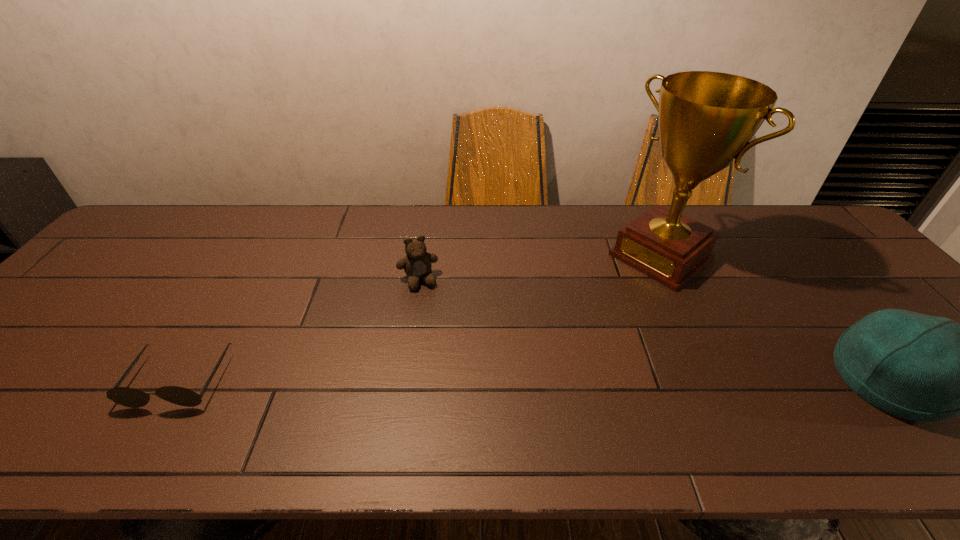
Find the location of a particular element. Image resolution: width=960 pixels, height=540 pixels. the shortest object is located at coordinates (129, 397).

The width and height of the screenshot is (960, 540). What are the coordinates of `the leftmost object` in the screenshot? It's located at (129, 397).

At what (x,y) coordinates should I click in order to perform the action: click on award. Please return your answer as a coordinate pair (x, y). Looking at the image, I should click on (706, 119).

You are a GUI agent. You are given a task and a screenshot of the screen. Output one action in this format:
    pyautogui.click(x=<x>, y=<y>)
    Task: Click on the tallest object
    
    Given the screenshot: What is the action you would take?
    pyautogui.click(x=706, y=119)

Where is `the second shortest object`? The height and width of the screenshot is (540, 960). the second shortest object is located at coordinates (417, 265).

Where is `teddy bear`? This screenshot has width=960, height=540. teddy bear is located at coordinates (417, 265).

Locate an element on the screen. This screenshot has width=960, height=540. free location located on the plaque of the tallest object is located at coordinates (593, 308).

I want to click on free space located on the plaque of the tallest object, so click(590, 310).

The height and width of the screenshot is (540, 960). What are the coordinates of `blank space located 0.080m on the plaque of the tallest object` in the screenshot? It's located at (613, 292).

This screenshot has height=540, width=960. Identify the location of vacant space situated on the face of the teddy bear. (449, 371).